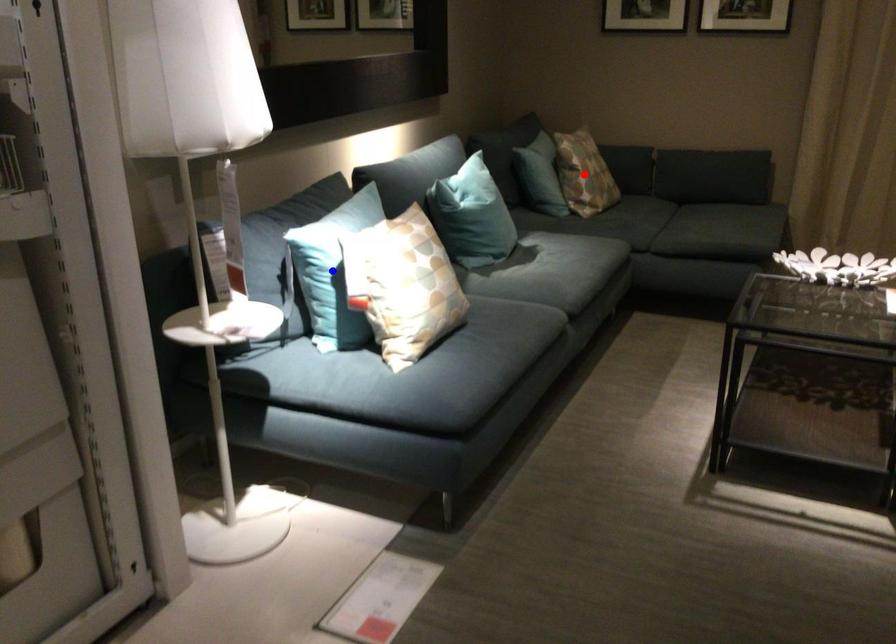
Question: In the image, two points are highlighted. Which point is nearer to the camera? Reply with the corresponding letter.

Choices:
 (A) blue point
 (B) red point

Answer: (A)